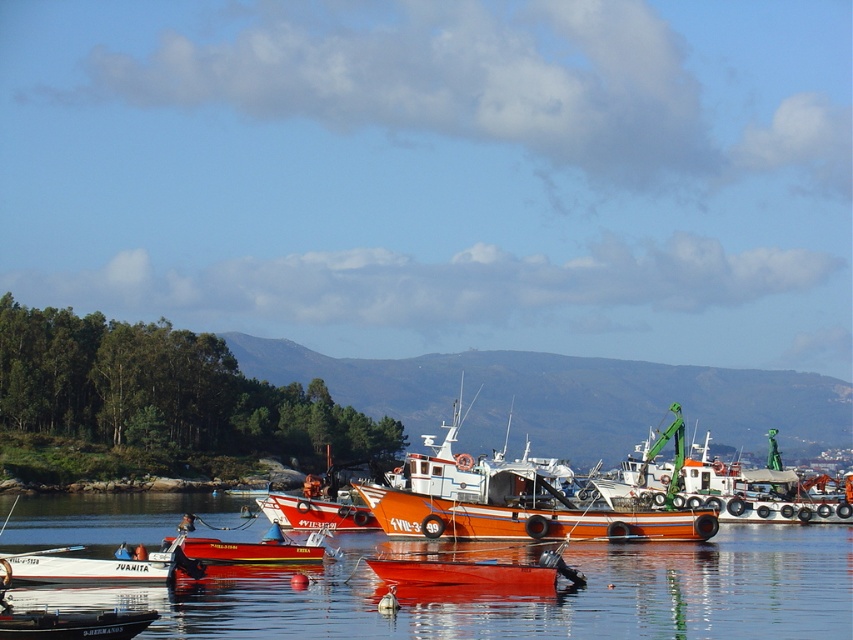
Which of these two, glossy water at center or orange matte fishing boat at center, stands taller?

orange matte fishing boat at center is taller.

Can you confirm if glossy water at center is positioned to the right of orange matte fishing boat at center?

Incorrect, glossy water at center is not on the right side of orange matte fishing boat at center.

Locate an element on the screen. This screenshot has width=853, height=640. glossy water at center is located at coordinates (521, 595).